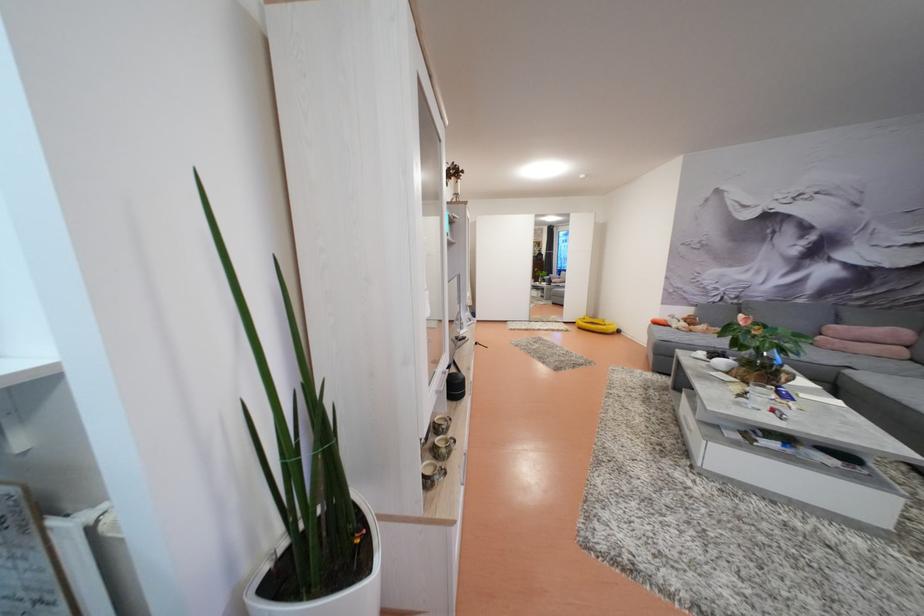
Locate an element on the screen. yellow toy handle is located at coordinates (596, 323).